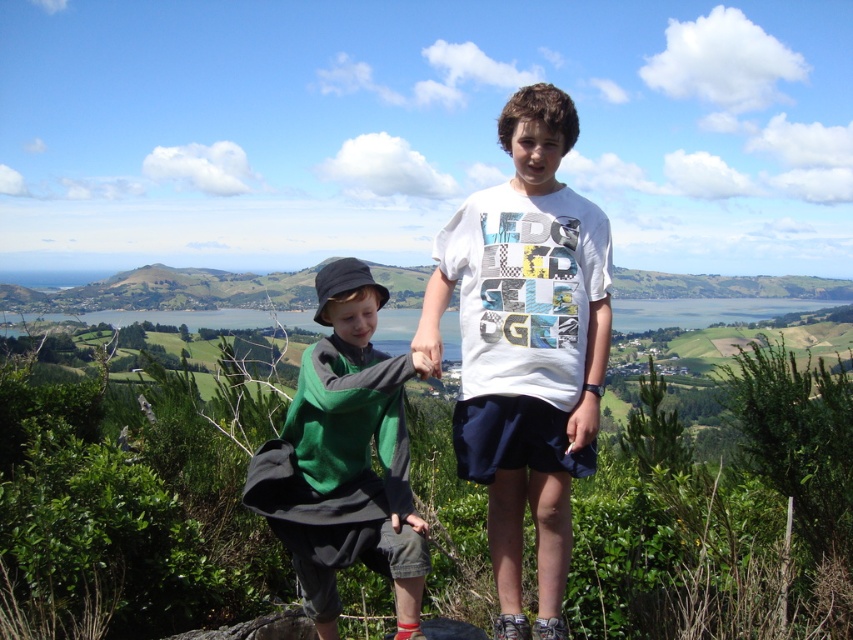
Does point (608, 336) come closer to viewer compared to point (408, 588)?

No, it is not.

Measure the distance between point (x=549, y=173) and camera.

The distance of point (x=549, y=173) from camera is 16.03 meters.

Image resolution: width=853 pixels, height=640 pixels. What do you see at coordinates (526, 348) in the screenshot?
I see `white printed t-shirt at center` at bounding box center [526, 348].

Where is `white printed t-shirt at center`? white printed t-shirt at center is located at coordinates (526, 348).